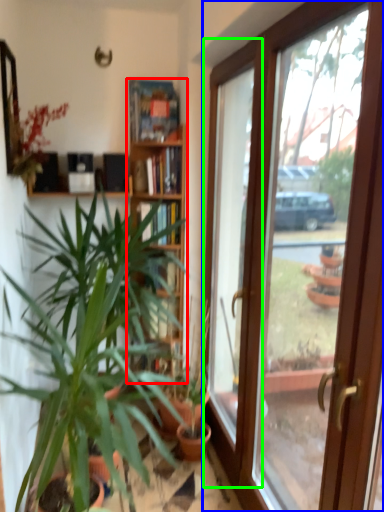
Question: Which is nearer to the bookcase (highlighted by a red box)? door (highlighted by a blue box) or window (highlighted by a green box).

Choices:
 (A) door
 (B) window

Answer: (B)